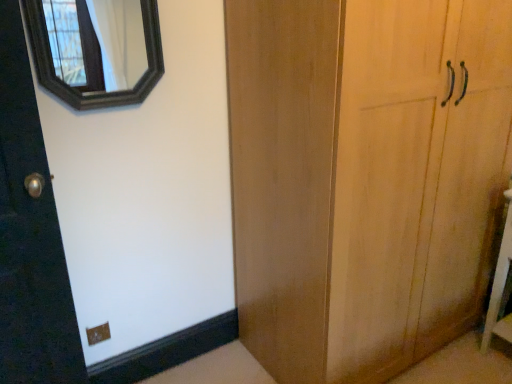
The width and height of the screenshot is (512, 384). Describe the element at coordinates (97, 43) in the screenshot. I see `black wooden mirror at upper left` at that location.

This screenshot has height=384, width=512. I want to click on black wooden mirror at upper left, so click(97, 43).

Where is `white wood vanity at lower right`? This screenshot has width=512, height=384. white wood vanity at lower right is located at coordinates (500, 286).

Describe the element at coordinates (500, 286) in the screenshot. I see `white wood vanity at lower right` at that location.

Locate an element on the screen. black wooden mirror at upper left is located at coordinates (97, 43).

Consider the image. Based on their positions, is black wooden mirror at upper left located to the left or right of white wood vanity at lower right?

Clearly, black wooden mirror at upper left is on the left of white wood vanity at lower right in the image.

Between black wooden mirror at upper left and white wood vanity at lower right, which one is positioned behind?

Positioned behind is white wood vanity at lower right.

Is point (114, 16) farther from viewer compared to point (500, 253)?

Yes, point (114, 16) is farther from viewer.

Based on the photo, from the image's perspective, does black wooden mirror at upper left appear lower than white wood vanity at lower right?

No.

From a real-world perspective, which object rests below the other?

white wood vanity at lower right.

Looking at their sizes, would you say black wooden mirror at upper left is wider or thinner than white wood vanity at lower right?

In the image, black wooden mirror at upper left appears to be more narrow than white wood vanity at lower right.

Between black wooden mirror at upper left and white wood vanity at lower right, which one has more height?

With more height is white wood vanity at lower right.

Considering the relative sizes of black wooden mirror at upper left and white wood vanity at lower right in the image provided, is black wooden mirror at upper left bigger than white wood vanity at lower right?

No.

Is black wooden mirror at upper left situated inside white wood vanity at lower right or outside?

black wooden mirror at upper left is not enclosed by white wood vanity at lower right.

Is black wooden mirror at upper left next to white wood vanity at lower right and touching it?

They are not placed beside each other.

Could you tell me if black wooden mirror at upper left is facing white wood vanity at lower right?

No, black wooden mirror at upper left is not facing towards white wood vanity at lower right.

What's the angular difference between black wooden mirror at upper left and white wood vanity at lower right's facing directions?

The facing directions of black wooden mirror at upper left and white wood vanity at lower right are 90.9 degrees apart.

At what (x,y) coordinates should I click in order to perform the action: click on vanity below the black wooden mirror at upper left (from the image's perspective). Please return your answer as a coordinate pair (x, y). Looking at the image, I should click on (500, 286).

Is white wood vanity at lower right to the left or to the right of black wooden mirror at upper left in the image?

From the image, it's evident that white wood vanity at lower right is to the right of black wooden mirror at upper left.

In the scene shown: Is the depth of white wood vanity at lower right greater than that of black wooden mirror at upper left?

Yes, white wood vanity at lower right is behind black wooden mirror at upper left.

Which is farther, (499, 325) or (111, 83)?

The point (111, 83) is farther.

From the image's perspective, which object appears higher, white wood vanity at lower right or black wooden mirror at upper left?

black wooden mirror at upper left appears higher in the image.

From a real-world perspective, is white wood vanity at lower right positioned above or below black wooden mirror at upper left?

In terms of real-world spatial position, white wood vanity at lower right is below black wooden mirror at upper left.

Is white wood vanity at lower right wider than black wooden mirror at upper left?

Correct, the width of white wood vanity at lower right exceeds that of black wooden mirror at upper left.

Considering the relative sizes of white wood vanity at lower right and black wooden mirror at upper left in the image provided, is white wood vanity at lower right shorter than black wooden mirror at upper left?

Incorrect, the height of white wood vanity at lower right does not fall short of that of black wooden mirror at upper left.

Is white wood vanity at lower right smaller than black wooden mirror at upper left?

Actually, white wood vanity at lower right might be larger than black wooden mirror at upper left.

Is black wooden mirror at upper left located within white wood vanity at lower right?

No, black wooden mirror at upper left is not inside white wood vanity at lower right.

Is white wood vanity at lower right not close to black wooden mirror at upper left?

Yes.

Is white wood vanity at lower right facing towards black wooden mirror at upper left?

No, white wood vanity at lower right is not aimed at black wooden mirror at upper left.

What's the angular difference between white wood vanity at lower right and black wooden mirror at upper left's facing directions?

The facing directions of white wood vanity at lower right and black wooden mirror at upper left are 90.9 degrees apart.

Locate an element on the screen. The height and width of the screenshot is (384, 512). mirror positioned vertically above the white wood vanity at lower right (from a real-world perspective) is located at coordinates (97, 43).

Identify the location of vanity on the right of black wooden mirror at upper left. (500, 286).

Find the location of a particular element. The width and height of the screenshot is (512, 384). vanity behind the black wooden mirror at upper left is located at coordinates (500, 286).